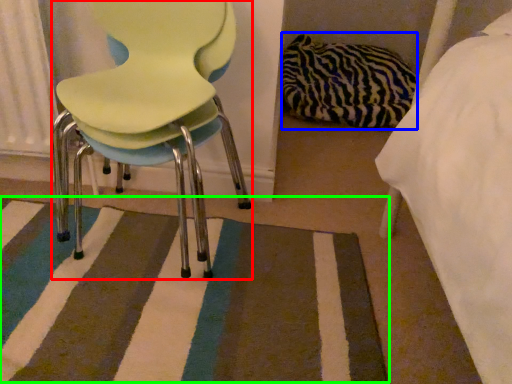
Question: Considering the real-world distances, which object is farthest from chair (highlighted by a red box)? material (highlighted by a blue box) or mat (highlighted by a green box)?

Choices:
 (A) material
 (B) mat

Answer: (A)